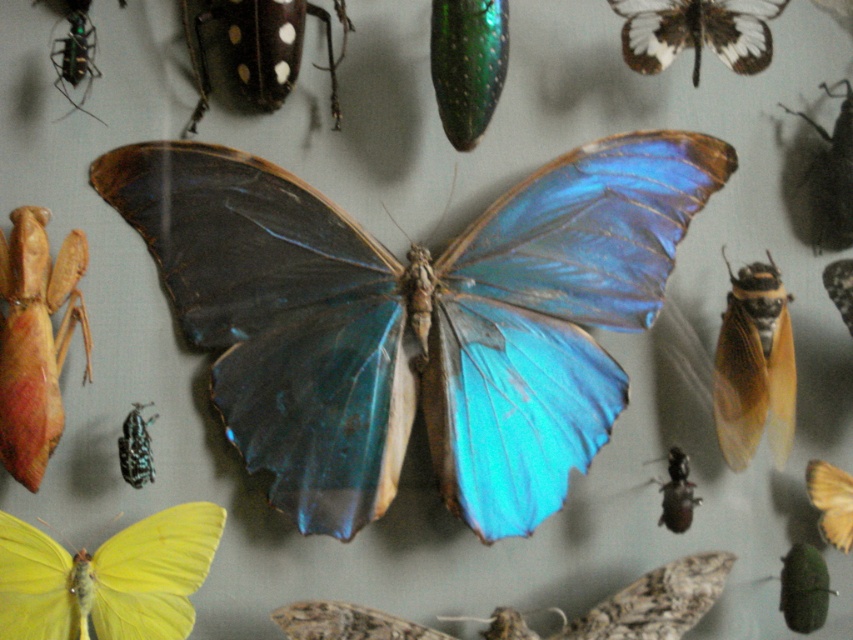
You are an entomologist who needs to place a ruler between the iridescent blue wing at center and the green metallic beetle at upper left to measure their distance. How far apart are they?

The iridescent blue wing at center and the green metallic beetle at upper left are 11.00 inches apart from each other.

You are standing 4.27 feet away from the point at coordinates (498, 24) in the image. Can you see the large butterfly with iridescent blue wings at the center of the image from your current position?

Yes, you can see the large butterfly with iridescent blue wings at the center of the image from your current position because you are standing 4.27 feet away from the point at coordinates (498, 24), which is within a reasonable viewing distance.